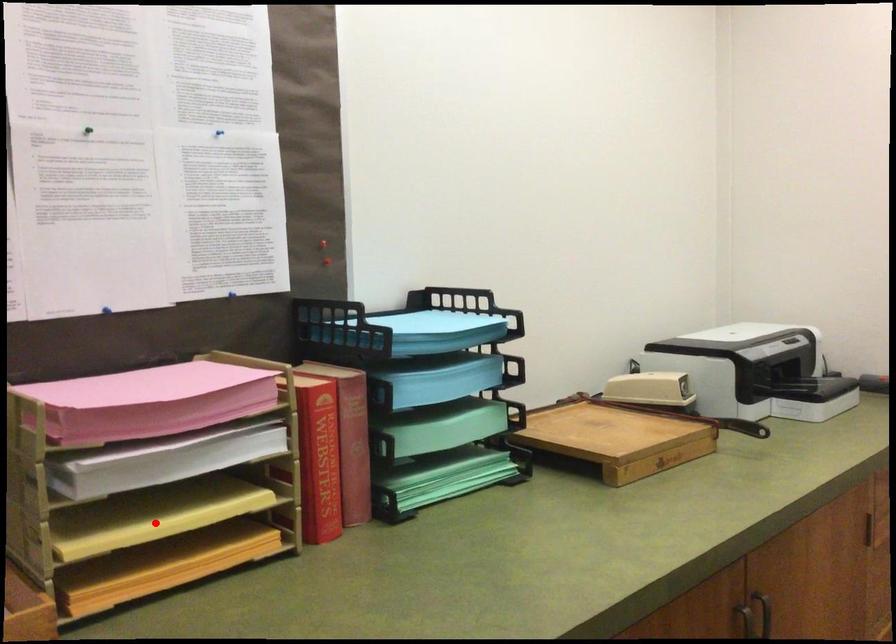
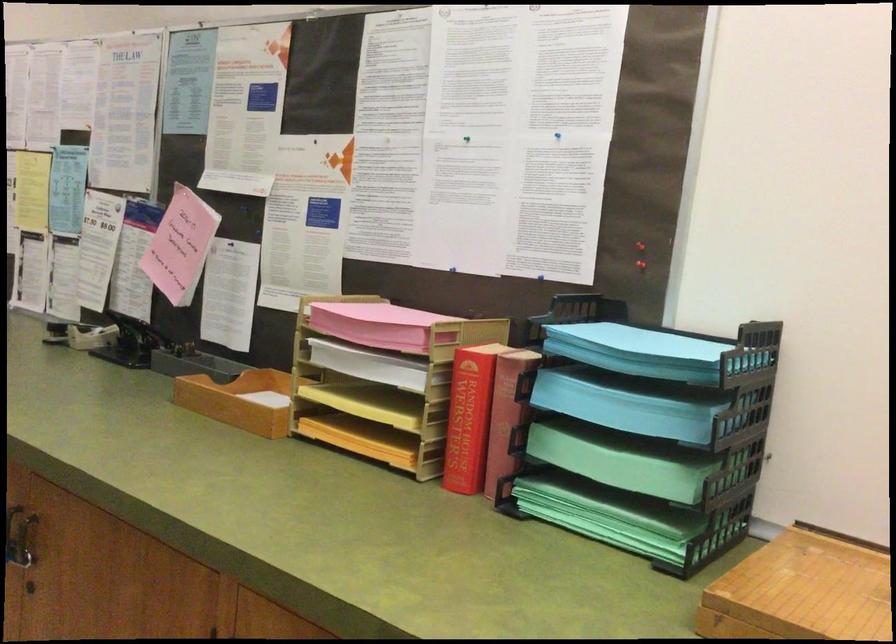
Question: I am providing you with two images of the same scene from different viewpoints. In image1, a red point is highlighted. Considering the same 3D point in image2, which of the following is correct?

Choices:
 (A) It is closer
 (B) It is farther

Answer: (B)